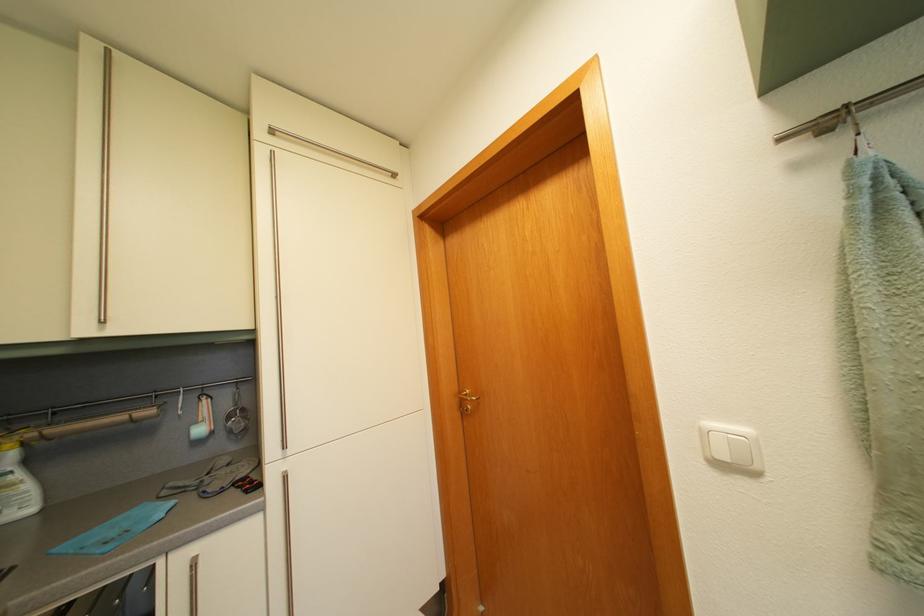
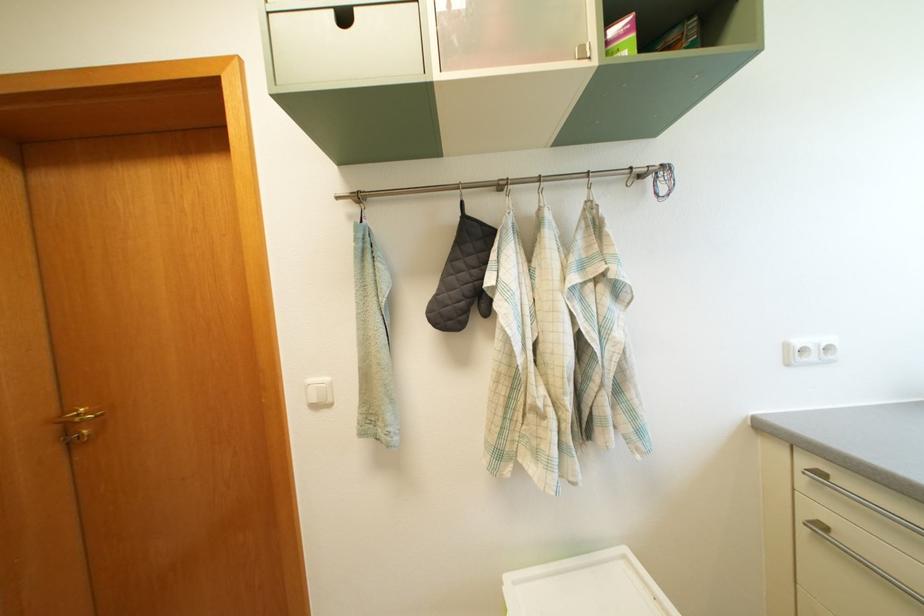
Question: The camera is either moving clockwise (left) or counter-clockwise (right) around the object. The first image is from the beginning of the video and the second image is from the end. Is the camera moving left or right when shooting the video?

Choices:
 (A) Left
 (B) Right

Answer: (A)